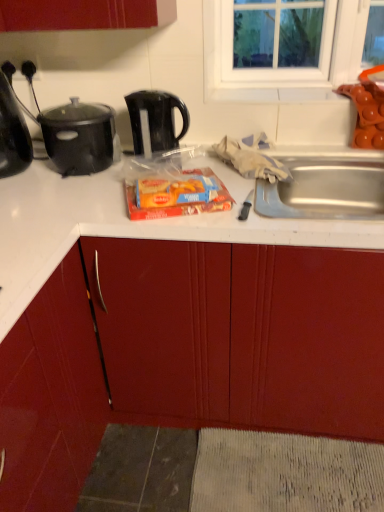
Image resolution: width=384 pixels, height=512 pixels. Find the location of `free space in front of shiny black kettle at left`. free space in front of shiny black kettle at left is located at coordinates (22, 198).